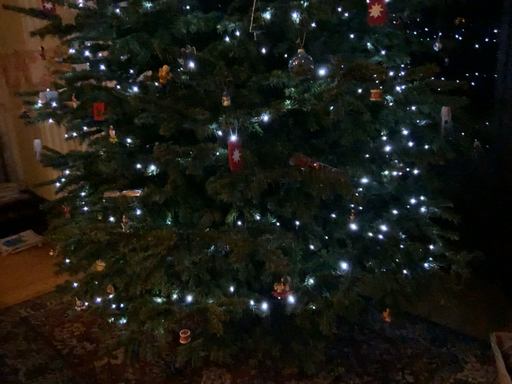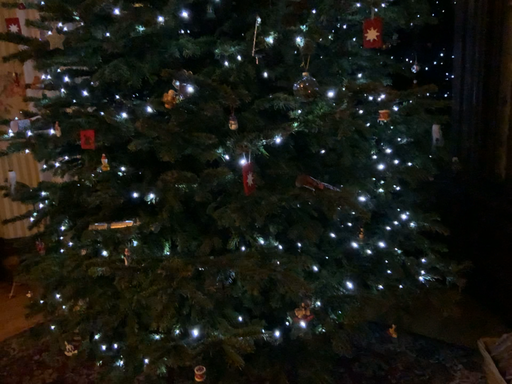
Question: Which way did the camera rotate in the video?

Choices:
 (A) rotated left
 (B) rotated right

Answer: (B)